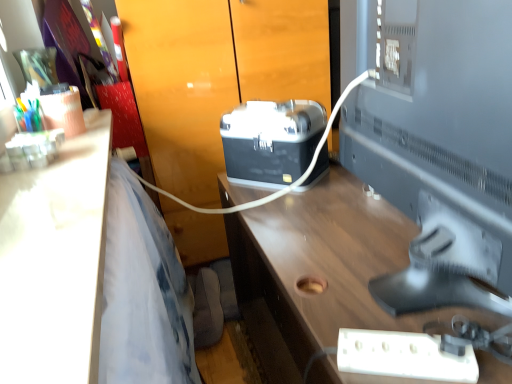
At what (x,y) coordinates should I click in order to perform the action: click on vacant space that's between white plastic extension cord at lower right and black plastic projector at center. Please return your answer as a coordinate pair (x, y). This screenshot has width=512, height=384. Looking at the image, I should click on (329, 241).